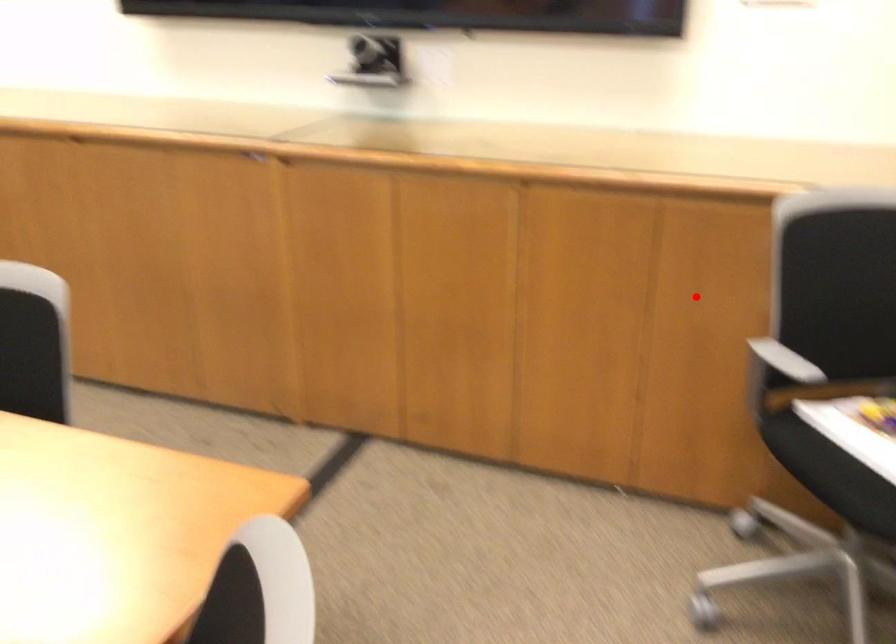
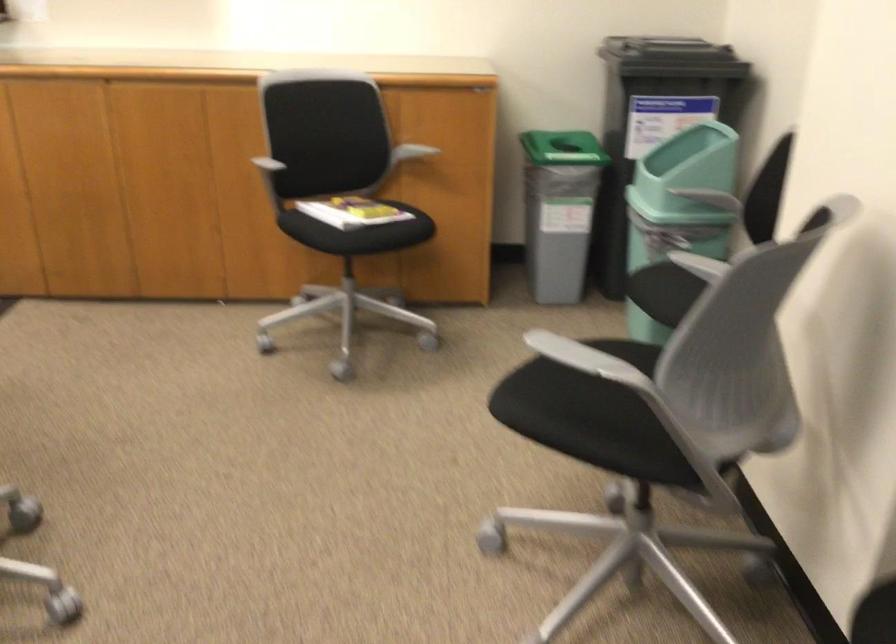
Locate, in the second image, the point that corresponds to the highlighted location in the first image.

(236, 149)